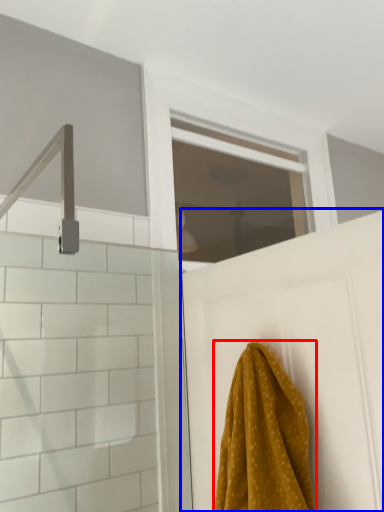
Question: Which point is closer to the camera, towel (highlighted by a red box) or door (highlighted by a blue box)?

Choices:
 (A) towel
 (B) door

Answer: (A)